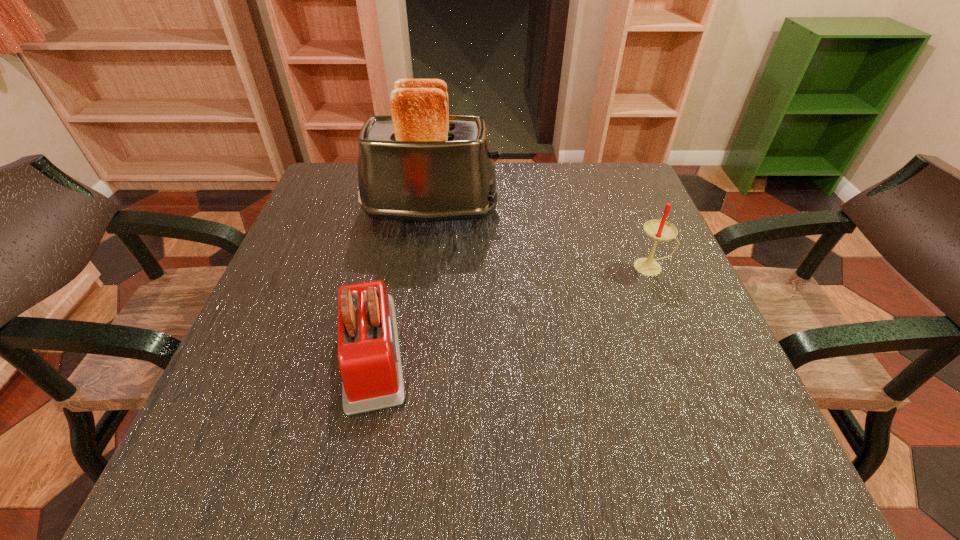
I want to click on object that can be found as the second closest to the shorter toaster, so click(660, 230).

This screenshot has width=960, height=540. In order to click on blank space that satisfies the following two spatial constraints: 1. on the side of the tallest object with the control lever; 2. on the right side of the candle in this screenshot , I will do `click(423, 267)`.

You are a GUI agent. You are given a task and a screenshot of the screen. Output one action in this format:
    pyautogui.click(x=<x>, y=<y>)
    Task: Click on the free location that satisfies the following two spatial constraints: 1. on the side of the farthest object with the control lever; 2. on the left side of the second farthest object
    The image size is (960, 540).
    Given the screenshot: What is the action you would take?
    pyautogui.click(x=423, y=267)

I want to click on vacant space that satisfies the following two spatial constraints: 1. on the side of the tallest object with the control lever; 2. on the left side of the candle, so click(423, 267).

I want to click on blank space that satisfies the following two spatial constraints: 1. on the back side of the second nearest object; 2. on the side of the taller toaster with the control lever, so click(629, 211).

Identify the location of vacant space that satisfies the following two spatial constraints: 1. on the side of the rightmost object with the control lever; 2. on the left side of the farther toaster. (423, 267).

Identify the location of vacant region that satisfies the following two spatial constraints: 1. on the side of the rightmost object with the control lever; 2. on the right side of the farthest object. The image size is (960, 540). (423, 267).

Locate an element on the screen. This screenshot has height=540, width=960. free space that satisfies the following two spatial constraints: 1. on the side of the farthest object with the control lever; 2. on the right side of the rightmost object is located at coordinates pos(423,267).

You are a GUI agent. You are given a task and a screenshot of the screen. Output one action in this format:
    pyautogui.click(x=<x>, y=<y>)
    Task: Click on the free region that satisfies the following two spatial constraints: 1. on the side of the rightmost object with the control lever; 2. on the right side of the taller toaster
    This screenshot has width=960, height=540.
    Given the screenshot: What is the action you would take?
    pyautogui.click(x=423, y=267)

Where is `free space in the image that satisfies the following two spatial constraints: 1. on the side of the farthest object with the control lever; 2. on the back side of the candle`? free space in the image that satisfies the following two spatial constraints: 1. on the side of the farthest object with the control lever; 2. on the back side of the candle is located at coordinates (423, 267).